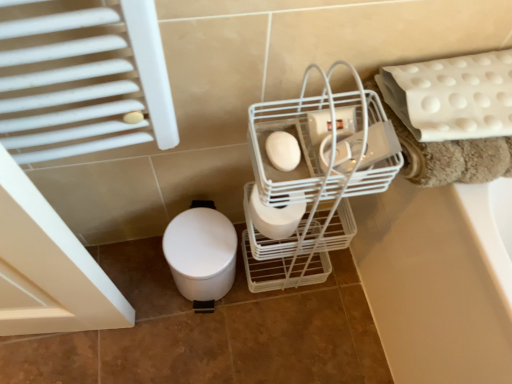
Question: Which direction should I rotate to look at white matte toilet paper at center, which is the second toilet paper from back to front, — up or down?

Choices:
 (A) down
 (B) up

Answer: (B)

Question: Which direction should I rotate to look at white matte toilet paper at center, which is the first toilet paper in bottom-to-top order, — up or down?

Choices:
 (A) down
 (B) up

Answer: (A)

Question: Could you tell me if white matte toilet at lower left is facing white matte toilet paper at center, the first toilet paper viewed from the top?

Choices:
 (A) yes
 (B) no

Answer: (B)

Question: From the image's perspective, is white matte toilet at lower left beneath white matte toilet paper at center, positioned as the 1th toilet paper in front-to-back order?

Choices:
 (A) yes
 (B) no

Answer: (A)

Question: Is white matte toilet at lower left at the left side of white matte toilet paper at center, which is the second toilet paper from back to front?

Choices:
 (A) no
 (B) yes

Answer: (B)

Question: Is white matte toilet at lower left far away from white matte toilet paper at center, positioned as the 1th toilet paper in front-to-back order?

Choices:
 (A) yes
 (B) no

Answer: (B)

Question: Is white matte toilet at lower left taller than white matte toilet paper at center, which is the second toilet paper from back to front?

Choices:
 (A) no
 (B) yes

Answer: (B)

Question: Is white matte toilet at lower left thinner than white matte toilet paper at center, the first toilet paper viewed from the top?

Choices:
 (A) yes
 (B) no

Answer: (B)

Question: Considering the relative positions of white wire basket at center and white matte toilet paper at center, which is the second toilet paper from back to front, in the image provided, is white wire basket at center behind white matte toilet paper at center, which is the second toilet paper from back to front,?

Choices:
 (A) no
 (B) yes

Answer: (A)

Question: Is white wire basket at center closer to the viewer compared to white matte toilet paper at center, positioned as the 1th toilet paper in front-to-back order?

Choices:
 (A) yes
 (B) no

Answer: (A)

Question: Considering the relative sizes of white wire basket at center and white matte toilet paper at center, positioned as the 1th toilet paper in front-to-back order, in the image provided, is white wire basket at center thinner than white matte toilet paper at center, positioned as the 1th toilet paper in front-to-back order,?

Choices:
 (A) yes
 (B) no

Answer: (B)

Question: Is there a large distance between white wire basket at center and white matte toilet paper at center, which is the second toilet paper from back to front?

Choices:
 (A) no
 (B) yes

Answer: (A)

Question: From a real-world perspective, is white wire basket at center positioned over white matte toilet paper at center, positioned as the 1th toilet paper in front-to-back order, based on gravity?

Choices:
 (A) yes
 (B) no

Answer: (B)

Question: Is white wire basket at center to the right of white matte toilet paper at center, the first toilet paper viewed from the top, from the viewer's perspective?

Choices:
 (A) yes
 (B) no

Answer: (A)

Question: From a real-world perspective, is white matte toilet at lower left under white wire basket at center?

Choices:
 (A) yes
 (B) no

Answer: (A)